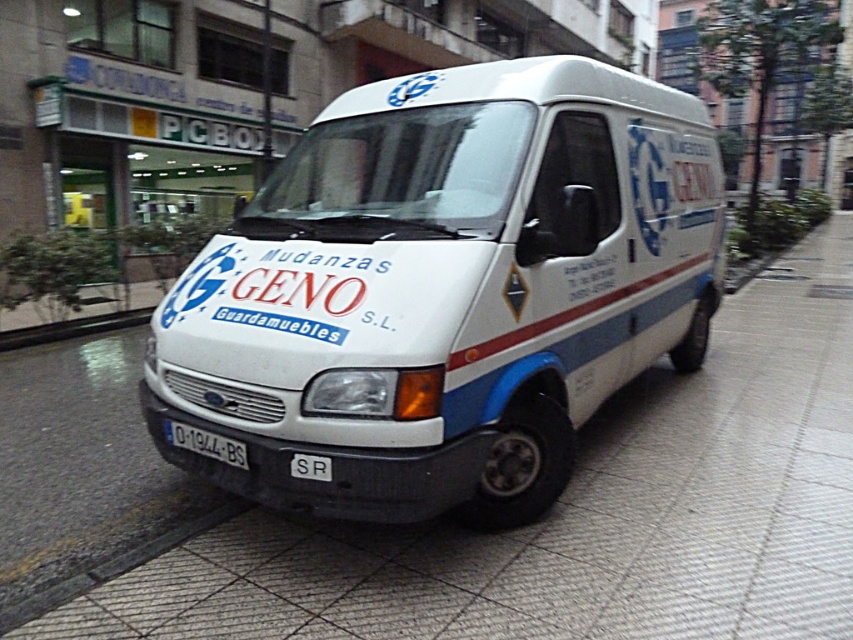
Question: Which point is closer to the camera?

Choices:
 (A) (202, 442)
 (B) (306, 492)

Answer: (B)

Question: Which of the following is the farthest from the observer?

Choices:
 (A) white plastic license plate at center
 (B) white matte van at center

Answer: (A)

Question: Is white tile pavement at center positioned in front of white plastic license plate at center?

Choices:
 (A) yes
 (B) no

Answer: (A)

Question: Does white tile pavement at center appear on the left side of white plastic license plate at center?

Choices:
 (A) yes
 (B) no

Answer: (B)

Question: Can you confirm if white matte van at center is positioned below white tile pavement at center?

Choices:
 (A) yes
 (B) no

Answer: (B)

Question: Considering the real-world distances, which object is closest to the white tile pavement at center?

Choices:
 (A) white matte van at center
 (B) white plastic license plate at center

Answer: (A)